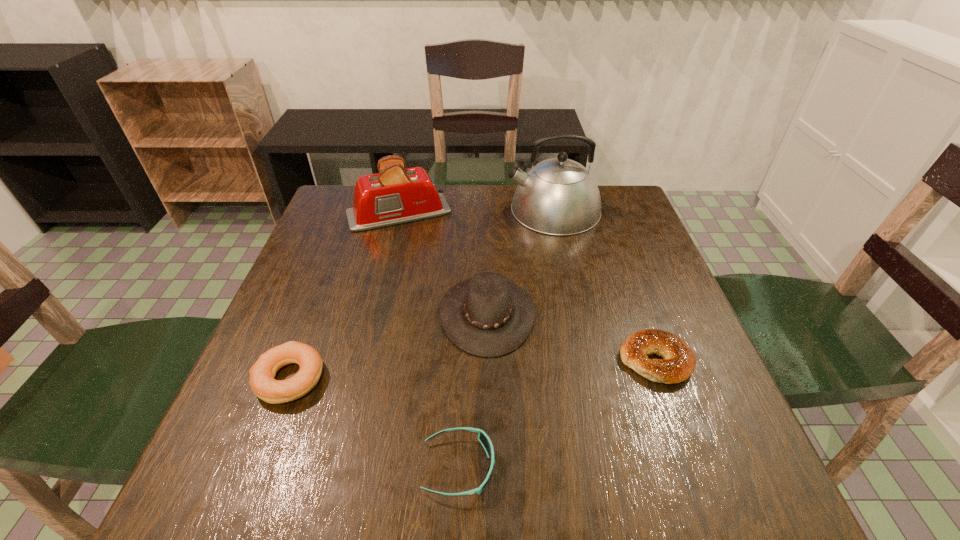
You are a GUI agent. You are given a task and a screenshot of the screen. Output one action in this format:
    pyautogui.click(x=<x>, y=<y>)
    Task: Click on the empty space that is in between the fourth shortest object and the right bagel
    The height and width of the screenshot is (540, 960).
    Given the screenshot: What is the action you would take?
    pyautogui.click(x=571, y=338)

Locate which object ranks second in proximity to the nearest object. Please provide its 2D coordinates. Your answer should be formatted as a tuple, i.e. [(x, y)], where the tuple contains the x and y coordinates of a point satisfying the conditions above.

[(262, 373)]

Select which object is the second closest to the sunglasses. Please provide its 2D coordinates. Your answer should be formatted as a tuple, i.e. [(x, y)], where the tuple contains the x and y coordinates of a point satisfying the conditions above.

[(262, 373)]

Find the location of a particular element. free location that satisfies the following two spatial constraints: 1. from the spout of the right bagel; 2. on the right side of the tallest object is located at coordinates (588, 360).